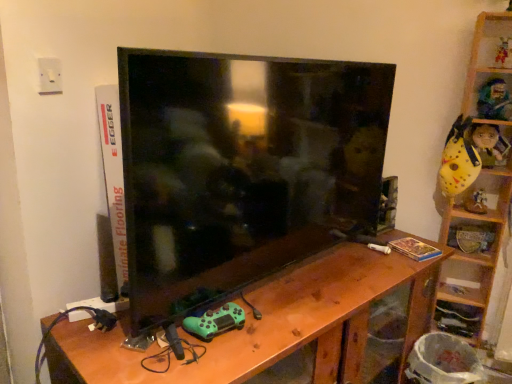
The height and width of the screenshot is (384, 512). Find the location of `vacant area that is in front of green matte controller at lower center, which is counted as the first toy, starting from the bottom`. vacant area that is in front of green matte controller at lower center, which is counted as the first toy, starting from the bottom is located at coordinates (211, 360).